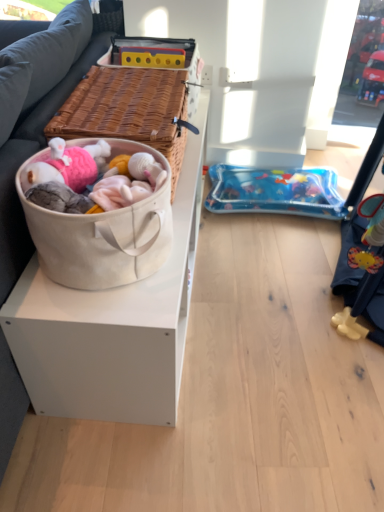
Question: Is woven brown picnic basket at left spatially inside blue inflatable mattress at lower right, or outside of it?

Choices:
 (A) inside
 (B) outside

Answer: (B)

Question: From the image's perspective, is woven brown picnic basket at left above or below blue inflatable mattress at lower right?

Choices:
 (A) above
 (B) below

Answer: (A)

Question: Which object is positioned farthest from the woven brown picnic basket at left?

Choices:
 (A) dark gray fabric couch at left
 (B) blue inflatable mattress at lower right
 (C) beige canvas basket at left

Answer: (B)

Question: Based on their relative distances, which object is farther from the dark gray fabric couch at left?

Choices:
 (A) woven brown picnic basket at left
 (B) beige canvas basket at left
 (C) blue inflatable mattress at lower right

Answer: (C)